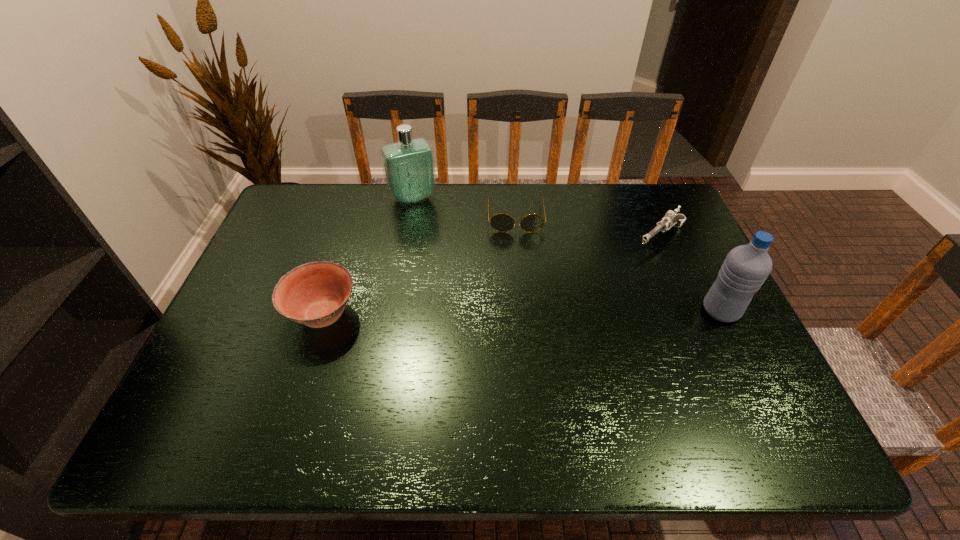
The width and height of the screenshot is (960, 540). I want to click on bowl, so click(x=315, y=294).

Identify the location of water bottle. This screenshot has height=540, width=960. (746, 267).

Where is `sunglasses`? sunglasses is located at coordinates (501, 222).

You are a GUI agent. You are given a task and a screenshot of the screen. Output one action in this format:
    pyautogui.click(x=<x>, y=<y>)
    Task: Click on the third object from left to right
    Image resolution: width=960 pixels, height=540 pixels.
    Given the screenshot: What is the action you would take?
    point(501,222)

Identify the location of gun. (670, 218).

Identify the location of perfume. The width and height of the screenshot is (960, 540). (408, 165).

I want to click on free space located on the right of the bowl, so click(x=466, y=315).

At what (x,y) coordinates should I click in order to perform the action: click on blank space located on the front of the water bottle. Please return your answer as a coordinate pair (x, y). Looking at the image, I should click on (761, 394).

Identify the location of free space located on the lenses of the sunglasses. (520, 292).

Identify the location of vacant area situated on the lenses of the sunglasses. Image resolution: width=960 pixels, height=540 pixels. (521, 303).